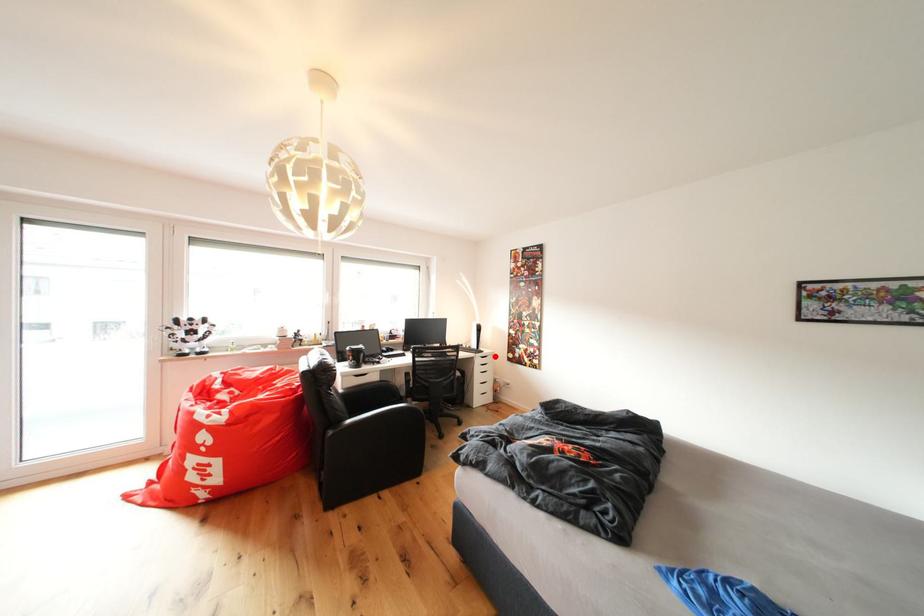
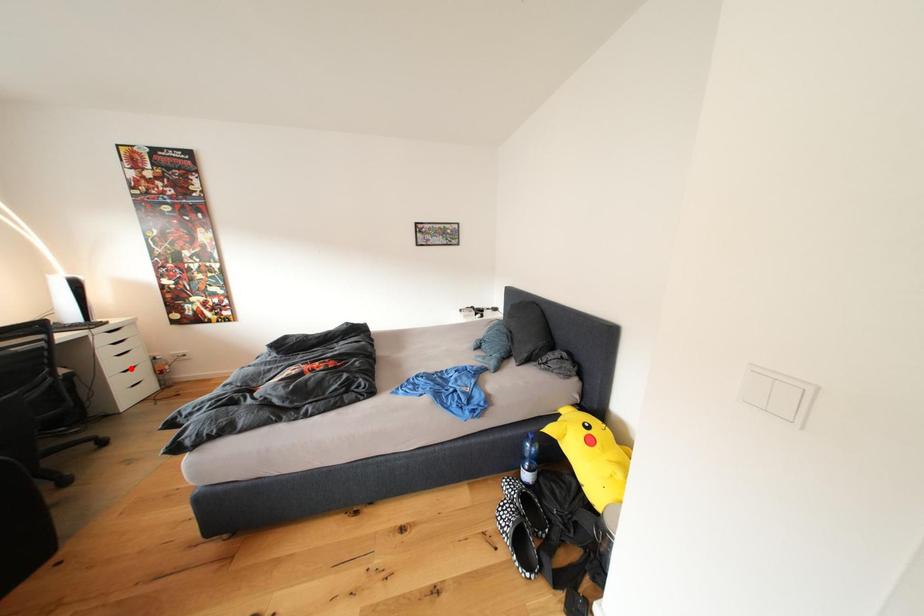
I am providing you with two images of the same scene from different viewpoints. A red point is marked on the first image and another point is marked on the second image. Does the point marked in image1 correspond to the same location as the one in image2?

No